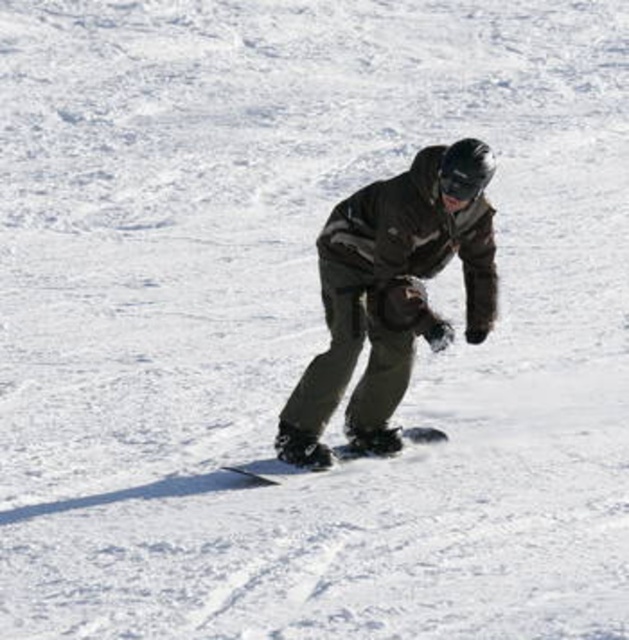
Is point (426, 440) more distant than point (438, 182)?

Yes, point (426, 440) is behind point (438, 182).

Who is lower down, black matte snowboard at center or black matte goggles at center?

black matte snowboard at center

I want to click on black matte snowboard at center, so point(269,470).